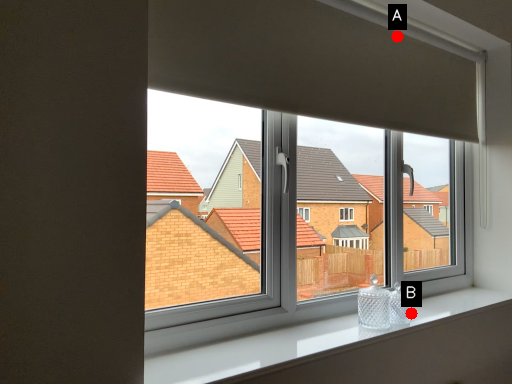
Question: Two points are circled on the image, labeled by A and B beside each circle. Which point is farther to the camera?

Choices:
 (A) A is further
 (B) B is further

Answer: (A)